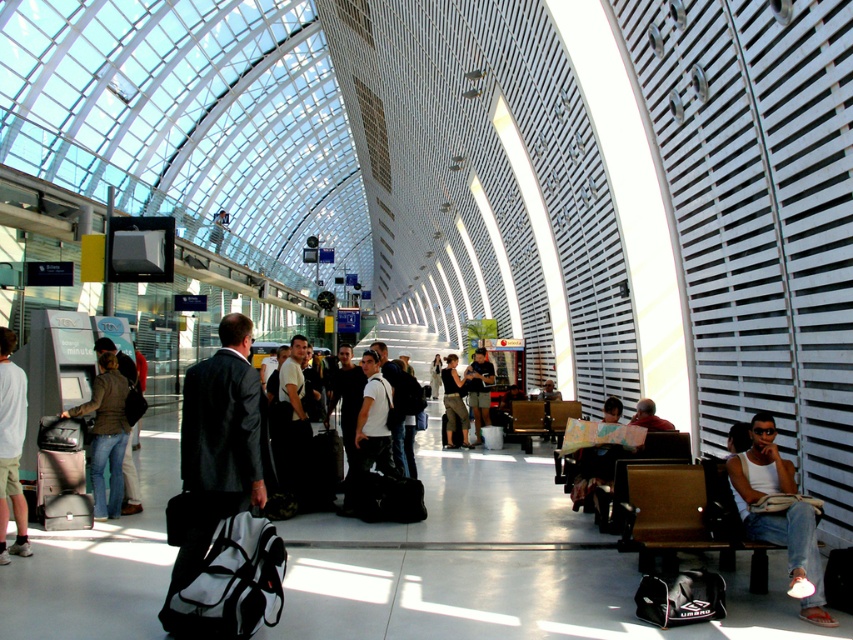
You are a photographer setting up a shoot in this terminal. You want to capture both the white cotton tank top at center right and the denim jacket at left in a single frame. Since your camera has a limited field of view, which object should you prioritize positioning closer to the lens to ensure both fit in the frame without cropping?

The white cotton tank top at center right occupies less space than the denim jacket at left, so you should position the denim jacket at left closer to the lens. This adjustment will help both objects fit within the camera frame without cropping, as the smaller white cotton tank top at center right can be placed further back while maintaining visibility.

You are navigating through the terminal and need to reach a specific location. You see two points marked in the scene. Which point is closer to you, the point at coordinates (775, 460) or the point at (483, 378)?

Point (775, 460) is in front of point (483, 378), so the point at (775, 460) is closer to you.